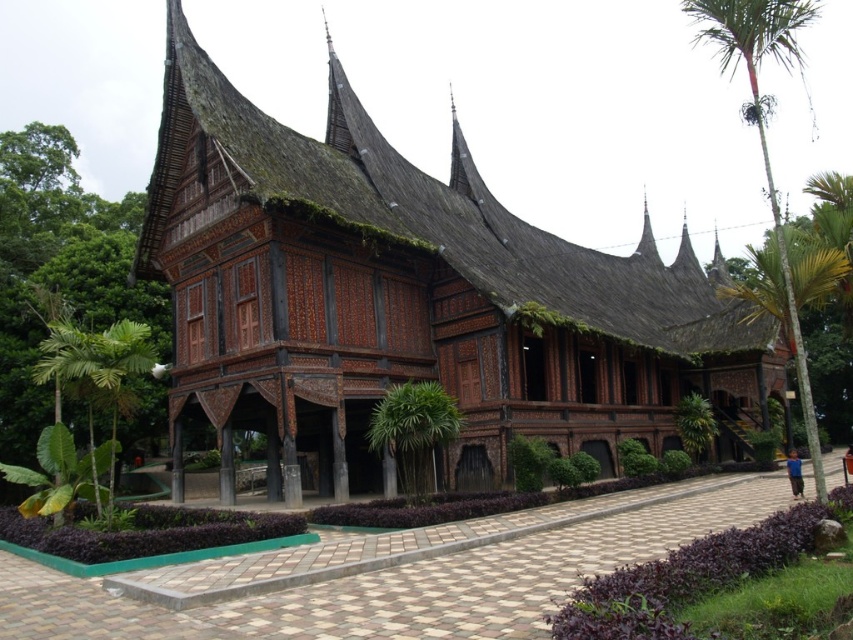
Who is positioned more to the right, green leafy tree at left or green leafy palm tree at left?

green leafy palm tree at left

Does green leafy tree at left have a smaller size compared to green leafy palm tree at left?

Incorrect, green leafy tree at left is not smaller in size than green leafy palm tree at left.

Is point (10, 257) closer to viewer compared to point (93, 344)?

That is False.

Find the location of a particular element. green leafy tree at left is located at coordinates (59, 269).

Is the position of green leafy palm tree at left more distant than that of green leafy palm tree at center?

No.

How much distance is there between green leafy palm tree at left and green leafy palm tree at center?

A distance of 78.49 feet exists between green leafy palm tree at left and green leafy palm tree at center.

Does point (140, 355) lie behind point (445, 397)?

No, it is in front of (445, 397).

The width and height of the screenshot is (853, 640). In order to click on green leafy palm tree at left in this screenshot , I will do `click(99, 371)`.

Is green leafy tree at left further to camera compared to green leafy palm tree at right?

Answer: Yes, it is.

Does point (144, 314) come in front of point (757, 33)?

That is False.

This screenshot has height=640, width=853. I want to click on green leafy tree at left, so click(59, 269).